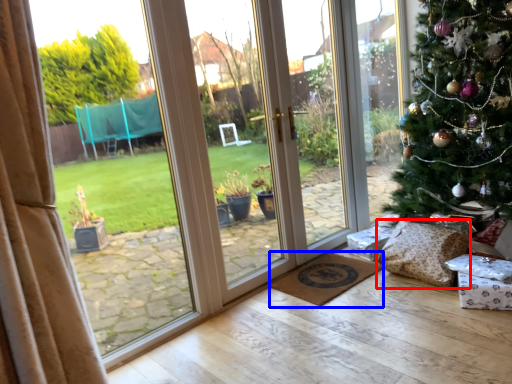
Question: Which point is further to the camera, pillow (highlighted by a red box) or doormat (highlighted by a blue box)?

Choices:
 (A) pillow
 (B) doormat

Answer: (B)